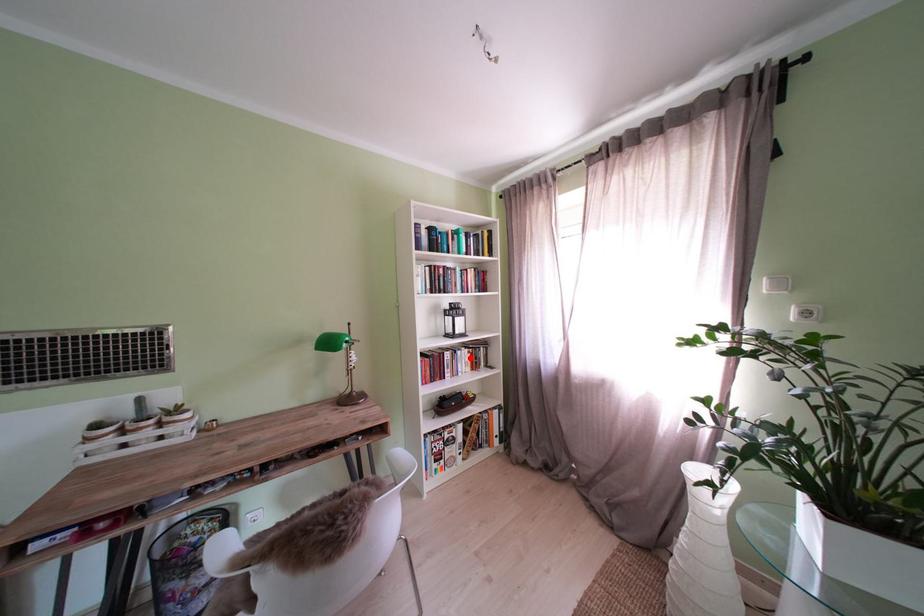
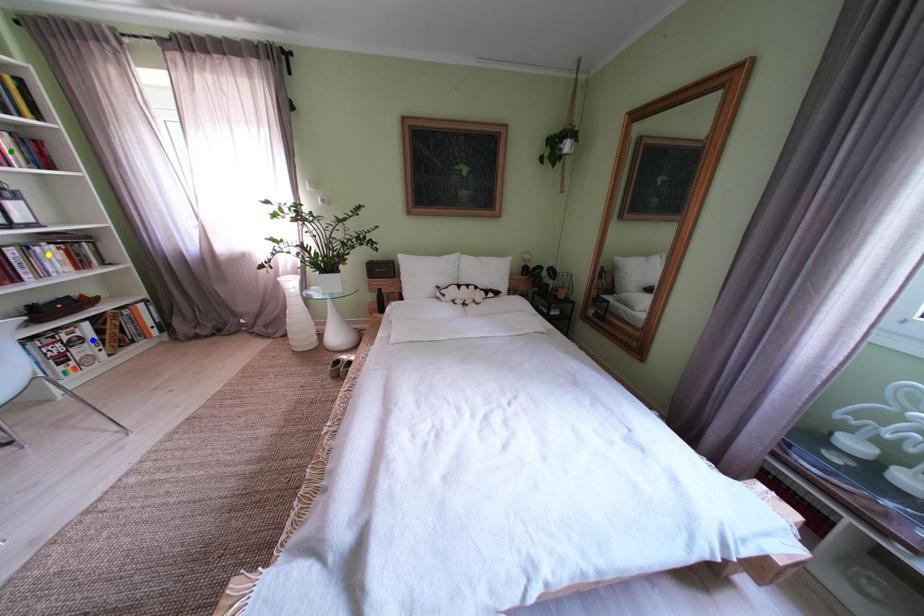
Question: I am providing you with two images of the same scene from different viewpoints. A red point is marked on the first image. You are given multiple points on the second image. Which spot in image 2 lines up with the point in image 1?

Choices:
 (A) yellow point
 (B) blue point
 (C) green point

Answer: (A)